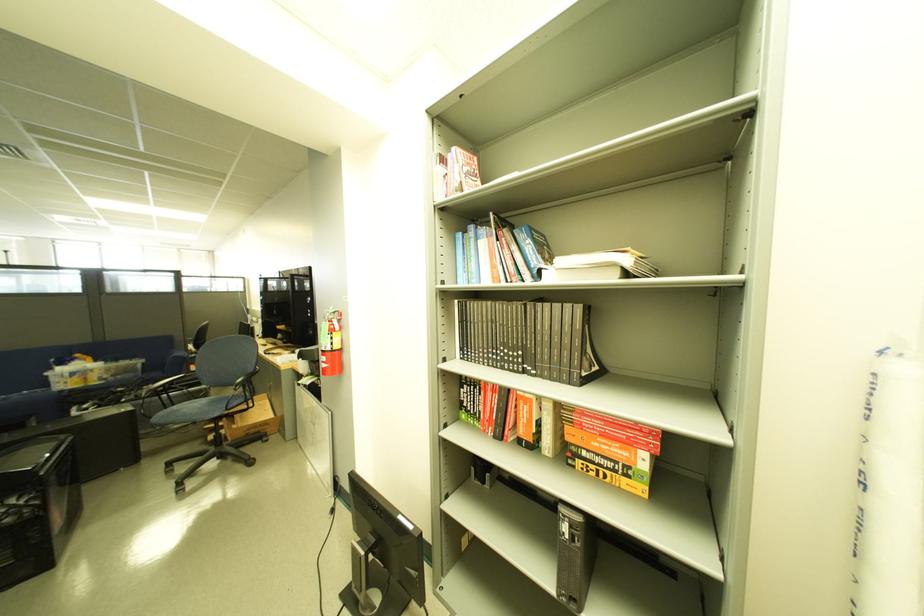
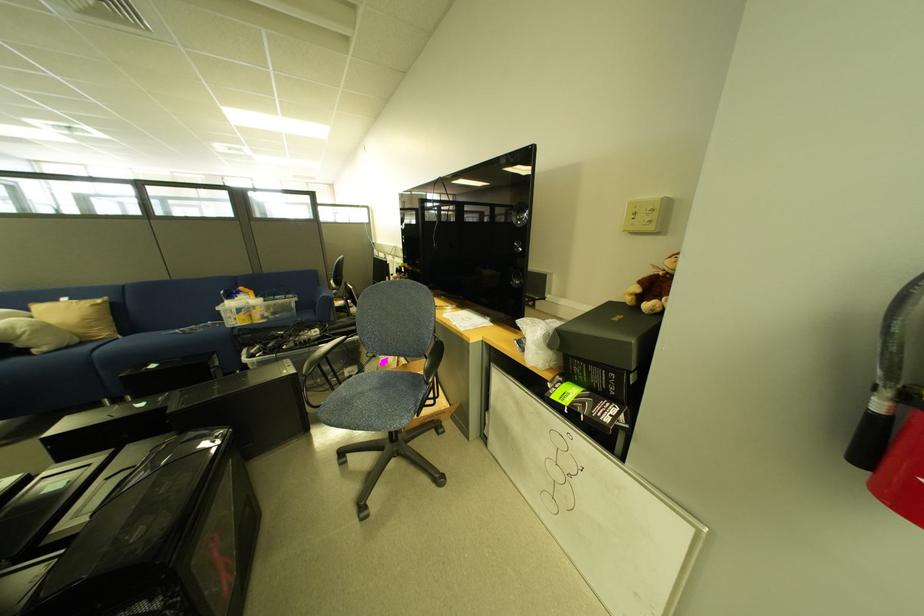
Locate, in the second image, the point that corresponds to the point at 112,365 in the first image.

(272, 302)